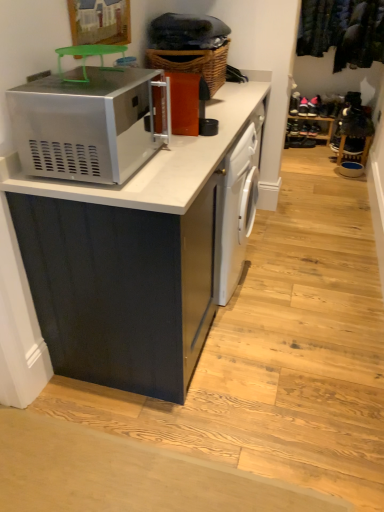
At what (x,y) coordinates should I click in order to perform the action: click on free space in front of matte black cabinet at center. Please return your answer as a coordinate pair (x, y). The image size is (384, 512). Looking at the image, I should click on (216, 415).